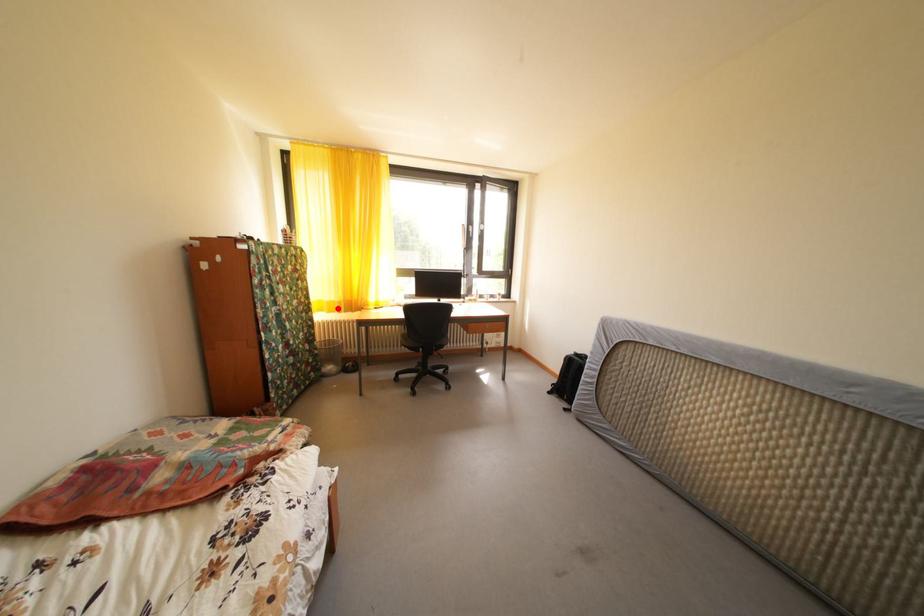
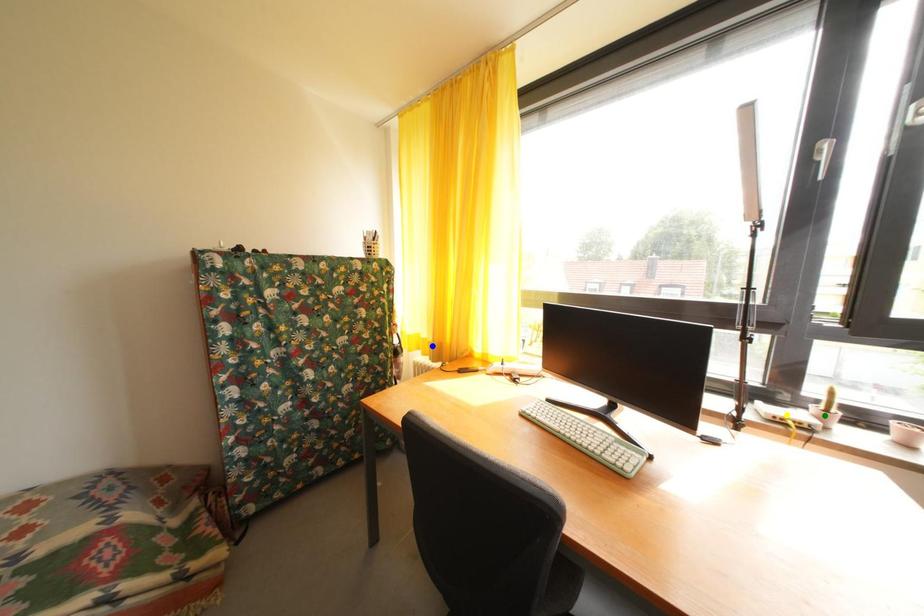
Question: I am providing you with two images of the same scene from different viewpoints. A red point is marked on the first image. You are given multiple points on the second image. Can you choose the point in image 2 that corresponds to the point in image 1?

Choices:
 (A) green point
 (B) blue point
 (C) yellow point

Answer: (B)